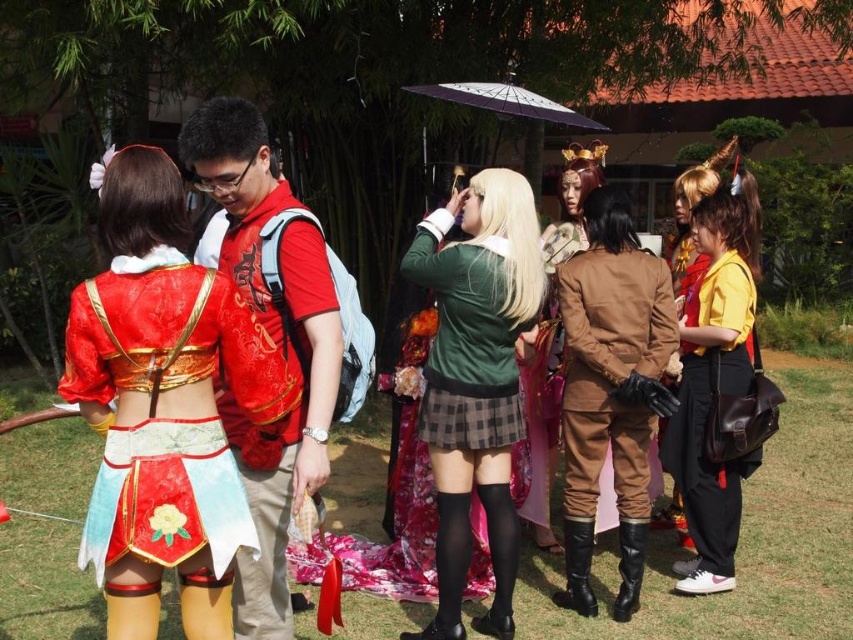
Is point (733, 492) farther from camera compared to point (570, 300)?

Yes, it is behind point (570, 300).

Does yellow matte jacket at right have a smaller size compared to brown leather jacket at center?

No.

You are a GUI agent. You are given a task and a screenshot of the screen. Output one action in this format:
    pyautogui.click(x=<x>, y=<y>)
    Task: Click on the yellow matte jacket at right
    The width and height of the screenshot is (853, 640).
    Given the screenshot: What is the action you would take?
    pyautogui.click(x=714, y=378)

Is point (236, 314) positioned before point (439, 502)?

That is True.

Can you confirm if shiny red fabric skirt at center is taller than green velvet jacket at center?

No.

Locate an element on the screen. The height and width of the screenshot is (640, 853). shiny red fabric skirt at center is located at coordinates (163, 404).

The width and height of the screenshot is (853, 640). What are the coordinates of `shiny red fabric skirt at center` in the screenshot? It's located at (163, 404).

Between shiny red fabric skirt at center and black leather boot at lower center, which one appears on the left side from the viewer's perspective?

shiny red fabric skirt at center

Is shiny red fabric skirt at center taller than black leather boot at lower center?

Correct, shiny red fabric skirt at center is much taller as black leather boot at lower center.

This screenshot has height=640, width=853. What do you see at coordinates (163, 404) in the screenshot?
I see `shiny red fabric skirt at center` at bounding box center [163, 404].

You are a GUI agent. You are given a task and a screenshot of the screen. Output one action in this format:
    pyautogui.click(x=<x>, y=<y>)
    Task: Click on the shiny red fabric skirt at center
    
    Given the screenshot: What is the action you would take?
    pyautogui.click(x=163, y=404)